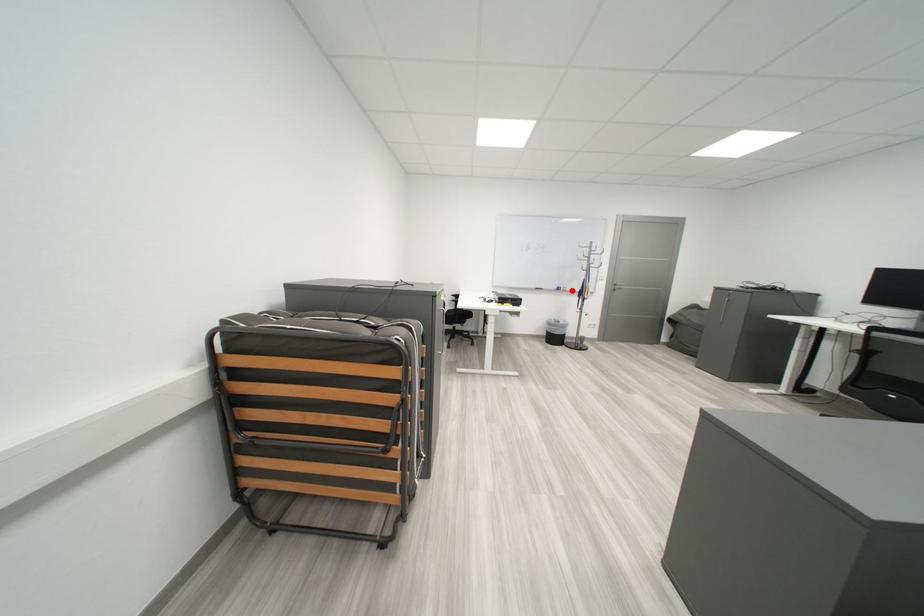
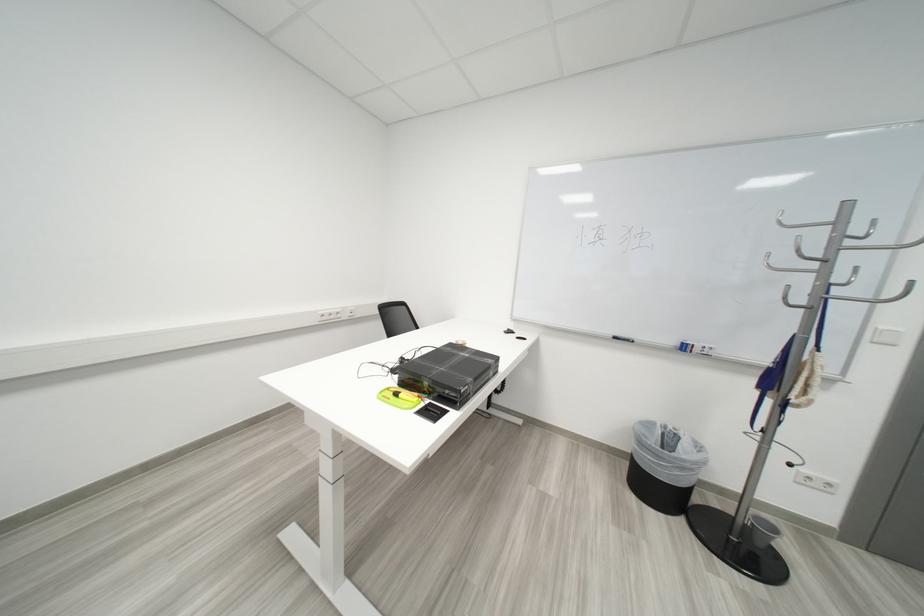
Where in the second image is the point corresponding to the highlighted location from the first image?

(698, 350)